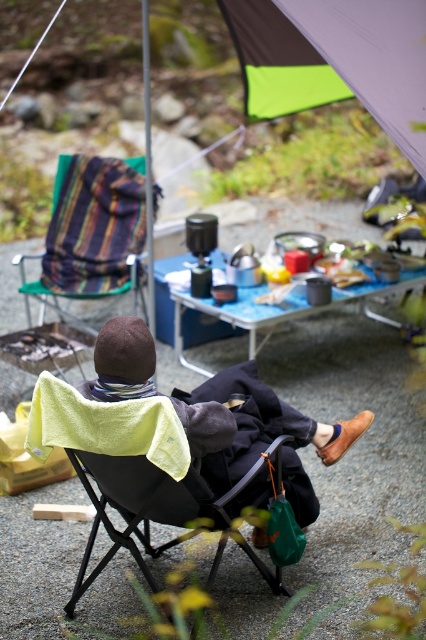
Can you confirm if dark brown knit hat at center is positioned above blue fabric picnic table at center?

No.

Which is behind, point (192, 392) or point (213, 314)?

The point (213, 314) is behind.

Which is in front, point (121, 388) or point (184, 321)?

Point (121, 388)

Identify the location of dark brown knit hat at center. The width and height of the screenshot is (426, 640). (261, 429).

Can you confirm if dark brown knit hat at center is shorter than striped fabric chair at left?

Indeed, dark brown knit hat at center has a lesser height compared to striped fabric chair at left.

Between point (218, 374) and point (88, 260), which one is positioned behind?

The point (88, 260) is behind.

Does point (149, 362) come in front of point (117, 289)?

Yes, point (149, 362) is in front of point (117, 289).

What are the coordinates of `dark brown knit hat at center` in the screenshot? It's located at (261, 429).

Between dark brown knit hat at center and black fabric chair at center, which one appears on the left side from the viewer's perspective?

Positioned to the left is black fabric chair at center.

Which of these two, dark brown knit hat at center or black fabric chair at center, stands taller?

With more height is dark brown knit hat at center.

Find the location of a particular element. dark brown knit hat at center is located at coordinates (261, 429).